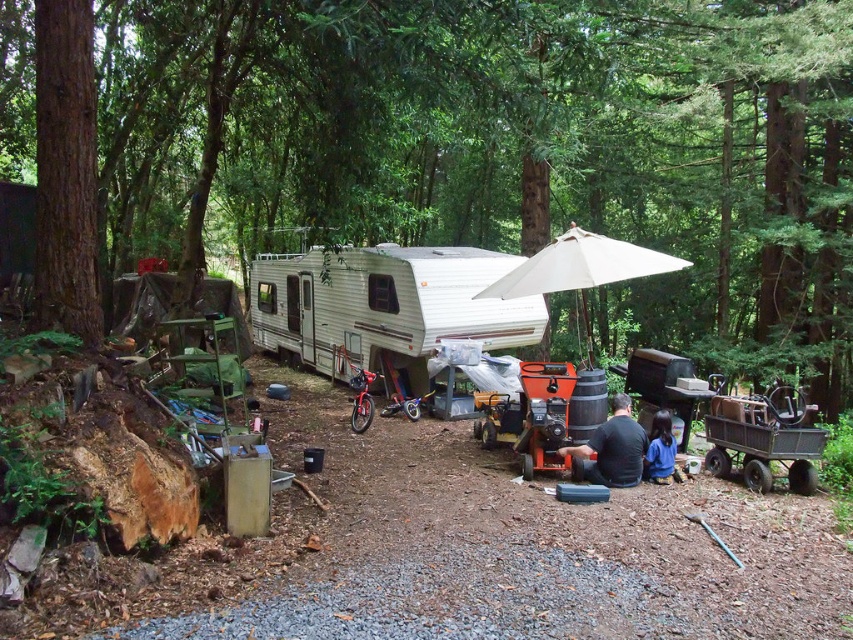
Is green textured tree at center closer to camera compared to brown rough bark tree at upper left?

Yes, it is in front of brown rough bark tree at upper left.

Between point (345, 61) and point (55, 307), which one is positioned behind?

The point (345, 61) is more distant.

Is point (636, 296) more distant than point (45, 148)?

Yes.

Identify the location of green textured tree at center. (508, 147).

Who is positioned more to the right, green textured tree at center or black matte shirt at center?

Positioned to the right is black matte shirt at center.

Image resolution: width=853 pixels, height=640 pixels. What do you see at coordinates (508, 147) in the screenshot?
I see `green textured tree at center` at bounding box center [508, 147].

Where is `green textured tree at center`? green textured tree at center is located at coordinates (508, 147).

Is point (807, 368) closer to viewer compared to point (561, 243)?

No, (807, 368) is behind (561, 243).

Can you confirm if green textured tree at center is taller than white fabric umbrella at center?

Yes, green textured tree at center is taller than white fabric umbrella at center.

Is point (183, 163) behind point (599, 256)?

Yes.

I want to click on green textured tree at center, so click(x=508, y=147).